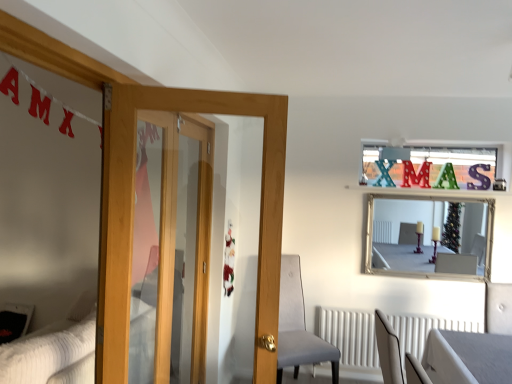
This screenshot has height=384, width=512. I want to click on free space above white textured radiator at lower center (from a real-world perspective), so click(x=389, y=310).